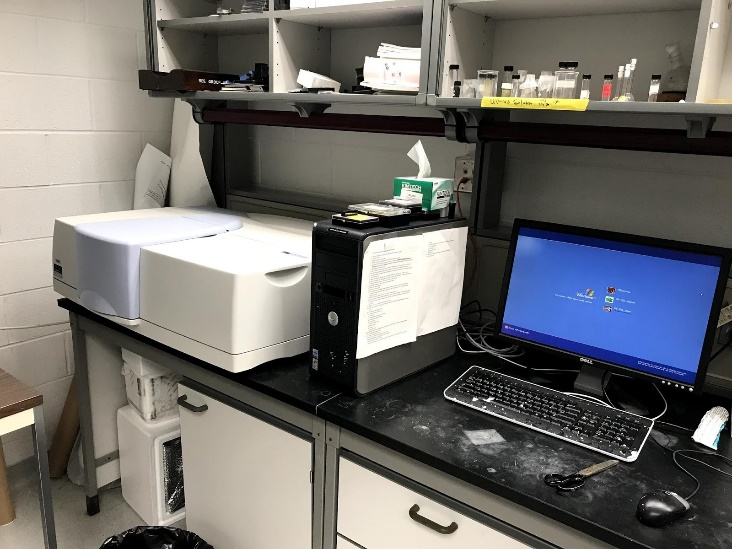
This screenshot has width=732, height=549. I want to click on shelf, so click(231, 85), click(340, 95), click(578, 104), click(714, 105), click(320, 10), click(206, 19).